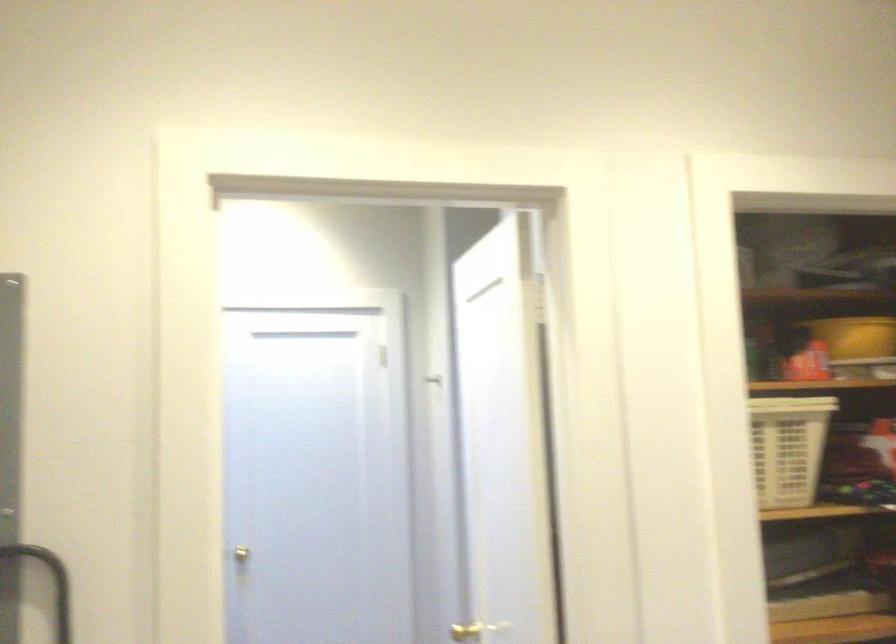
The width and height of the screenshot is (896, 644). Identify the location of white laundry basket. (788, 448).